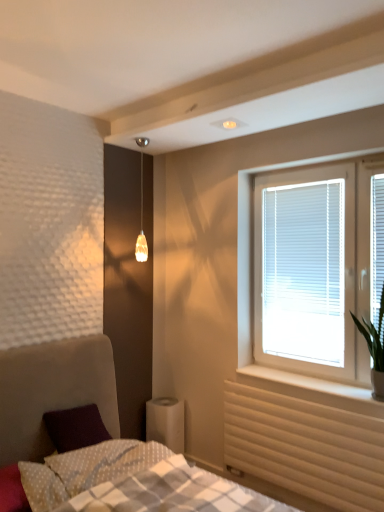
Question: Does beige textured radiator at lower right appear on the right side of translucent amber glass pendant light at upper center?

Choices:
 (A) yes
 (B) no

Answer: (A)

Question: Are beige textured radiator at lower right and translucent amber glass pendant light at upper center beside each other?

Choices:
 (A) yes
 (B) no

Answer: (B)

Question: From the image's perspective, is beige textured radiator at lower right over translucent amber glass pendant light at upper center?

Choices:
 (A) no
 (B) yes

Answer: (A)

Question: Can you confirm if beige textured radiator at lower right is positioned to the left of translucent amber glass pendant light at upper center?

Choices:
 (A) no
 (B) yes

Answer: (A)

Question: Is beige textured radiator at lower right not near translucent amber glass pendant light at upper center?

Choices:
 (A) yes
 (B) no

Answer: (A)

Question: In terms of height, does velvet purple pillow at lower left, which is the 1th pillow in right-to-left order, look taller or shorter compared to white dotted fabric pillow at lower left, which is counted as the 1th pillow, starting from the left?

Choices:
 (A) short
 (B) tall

Answer: (B)

Question: Which is correct: velvet purple pillow at lower left, which is the 1th pillow in right-to-left order, is inside white dotted fabric pillow at lower left, the 2th pillow positioned from the right, or outside of it?

Choices:
 (A) inside
 (B) outside

Answer: (B)

Question: In the image, is velvet purple pillow at lower left, positioned as the 2th pillow in left-to-right order, positioned in front of or behind white dotted fabric pillow at lower left, which is counted as the 1th pillow, starting from the left?

Choices:
 (A) front
 (B) behind

Answer: (A)

Question: From a real-world perspective, relative to white dotted fabric pillow at lower left, the 2th pillow positioned from the right, is velvet purple pillow at lower left, positioned as the 2th pillow in left-to-right order, vertically above or below?

Choices:
 (A) below
 (B) above

Answer: (B)

Question: Is white plastic blinds at upper right, marked as the first window screen in a left-to-right arrangement, taller or shorter than white blinds at right?

Choices:
 (A) short
 (B) tall

Answer: (A)

Question: Would you say white plastic blinds at upper right, positioned as the first window screen in back-to-front order, is inside or outside white blinds at right?

Choices:
 (A) outside
 (B) inside

Answer: (B)

Question: Considering the positions of point (286, 270) and point (246, 281), is point (286, 270) closer or farther from the camera than point (246, 281)?

Choices:
 (A) farther
 (B) closer

Answer: (B)

Question: From a real-world perspective, relative to white blinds at right, is white plastic blinds at upper right, arranged as the second window screen when viewed from the right, vertically above or below?

Choices:
 (A) below
 (B) above

Answer: (A)

Question: Considering the positions of white wood window sill at lower right and white plastic blinds at right, placed as the 2th window screen when sorted from left to right, in the image, is white wood window sill at lower right wider or thinner than white plastic blinds at right, placed as the 2th window screen when sorted from left to right,?

Choices:
 (A) thin
 (B) wide

Answer: (B)

Question: Is white wood window sill at lower right in front of or behind white plastic blinds at right, placed as the 2th window screen when sorted from left to right, in the image?

Choices:
 (A) behind
 (B) front

Answer: (B)